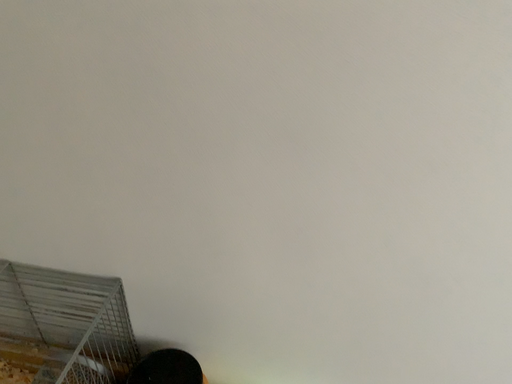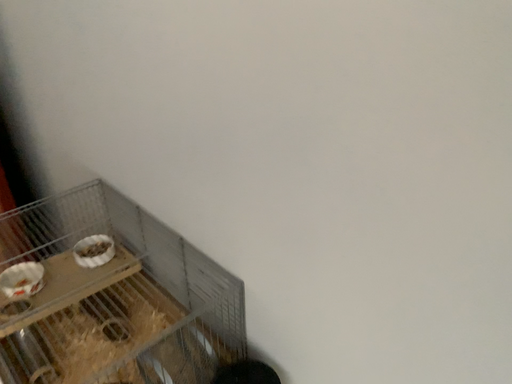
Question: Which way did the camera rotate in the video?

Choices:
 (A) rotated upward
 (B) rotated downward

Answer: (A)